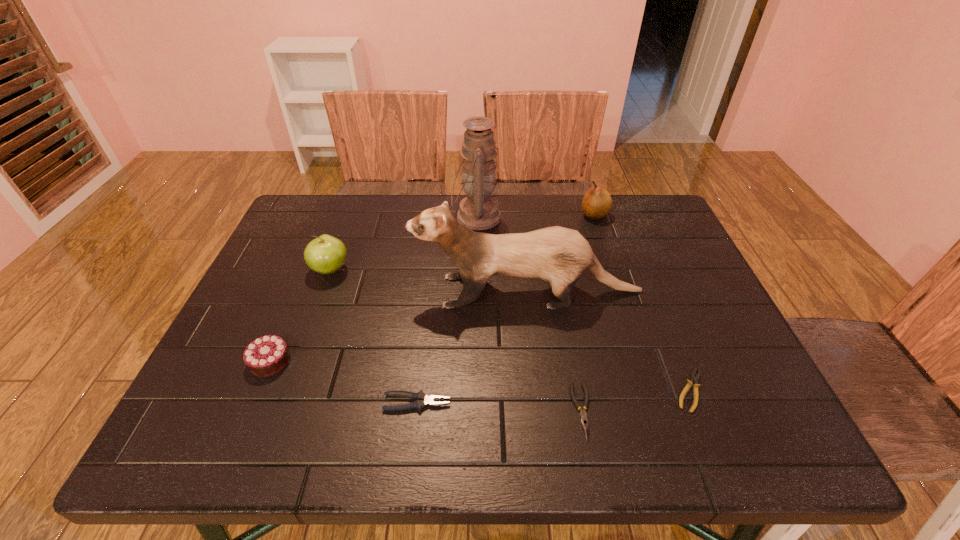
Where is `the rightmost pliers`? The width and height of the screenshot is (960, 540). the rightmost pliers is located at coordinates (695, 377).

At what (x,y) coordinates should I click in order to perform the action: click on vacant space located on the left of the tallest object. Please return your answer as a coordinate pair (x, y). This screenshot has width=960, height=540. Looking at the image, I should click on [429, 217].

Identify the location of vacant region located 0.360m on the face of the second tallest object. click(x=271, y=292).

Locate an element on the screen. vacant area situated on the face of the second tallest object is located at coordinates (295, 292).

The image size is (960, 540). I want to click on vacant space located 0.140m on the face of the second tallest object, so click(x=358, y=292).

Locate an element on the screen. The width and height of the screenshot is (960, 540). vacant space situated 0.300m on the left of the pear is located at coordinates (482, 215).

The image size is (960, 540). What are the coordinates of `vacant space located on the front of the apple` in the screenshot? It's located at (310, 325).

Where is `vacant space situated 0.220m on the back of the fourth shortest object`? Image resolution: width=960 pixels, height=540 pixels. vacant space situated 0.220m on the back of the fourth shortest object is located at coordinates (305, 278).

The width and height of the screenshot is (960, 540). In order to click on free location located at the gripping part of the leftmost pliers in this screenshot , I will do `click(495, 403)`.

Where is `vacant region located 0.280m on the right of the seventh tallest object`? vacant region located 0.280m on the right of the seventh tallest object is located at coordinates (734, 411).